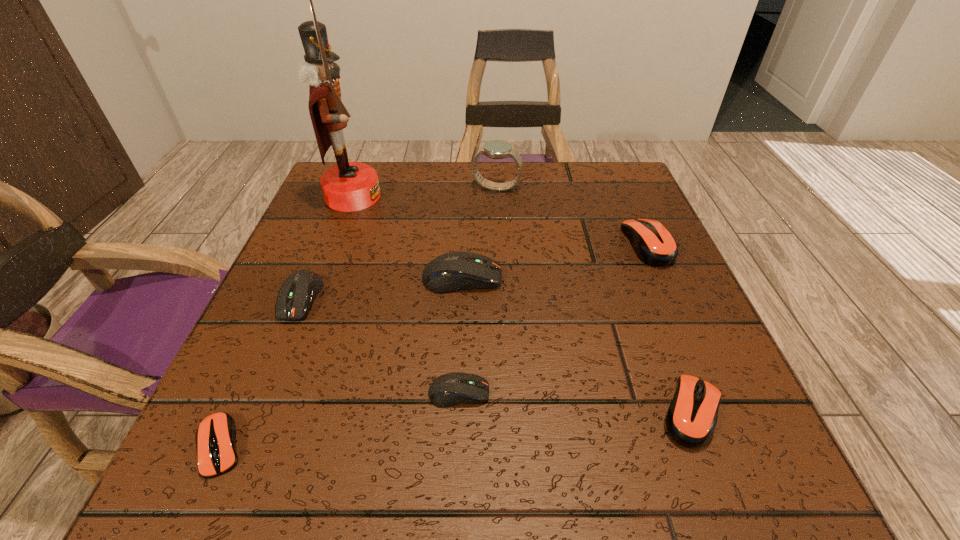
This screenshot has width=960, height=540. Identify the location of vacant region at the far left corner of the desktop. (384, 191).

In the image, there is a desktop. Identify the location of vacant area at the far right corner. The width and height of the screenshot is (960, 540). (603, 172).

Where is `free point between the shortest object and the smallest dark computer equipment`? free point between the shortest object and the smallest dark computer equipment is located at coordinates (340, 420).

Identify the location of empty space between the second biggest orange computer mouse and the biggest orange computer mouse. (670, 328).

Where is `empty location between the second smallest orange computer mouse and the blue watch`? empty location between the second smallest orange computer mouse and the blue watch is located at coordinates (594, 300).

I want to click on empty space that is in between the shortest object and the nutcracker, so [287, 321].

Locate an element on the screen. This screenshot has height=540, width=960. vacant region between the second smallest orange computer mouse and the second biggest dark computer equipment is located at coordinates (496, 355).

Find the location of `empty space between the tallest computer mouse and the second biggest orange computer mouse`. empty space between the tallest computer mouse and the second biggest orange computer mouse is located at coordinates (577, 345).

What are the coordinates of `vacant space in between the second smallest dark computer equipment and the shortest object` in the screenshot? It's located at (260, 372).

Where is `vacant space in between the blue watch and the tallest computer mouse`? The height and width of the screenshot is (540, 960). vacant space in between the blue watch and the tallest computer mouse is located at coordinates (479, 233).